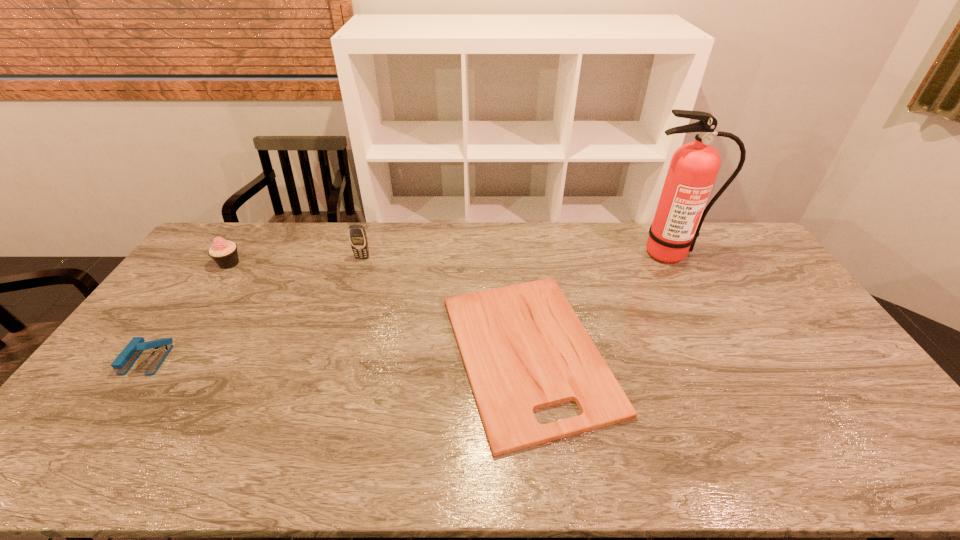
I want to click on vacant space that is in between the shortest object and the third shortest object, so click(379, 308).

Where is `free space that is in between the fourth object from left to right and the cellular telephone`? This screenshot has height=540, width=960. free space that is in between the fourth object from left to right and the cellular telephone is located at coordinates (445, 305).

The width and height of the screenshot is (960, 540). Find the location of `free area in between the stapler and the cupcake`. free area in between the stapler and the cupcake is located at coordinates (188, 311).

This screenshot has height=540, width=960. What are the coordinates of `free space between the cellular telephone and the stapler` in the screenshot? It's located at (254, 308).

Select which object appears as the second closest to the chopping board. Please provide its 2D coordinates. Your answer should be formatted as a tuple, i.e. [(x, y)], where the tuple contains the x and y coordinates of a point satisfying the conditions above.

[(357, 235)]

Locate which object ranks third in proximity to the shortest object. Please provide its 2D coordinates. Your answer should be formatted as a tuple, i.e. [(x, y)], where the tuple contains the x and y coordinates of a point satisfying the conditions above.

[(224, 253)]